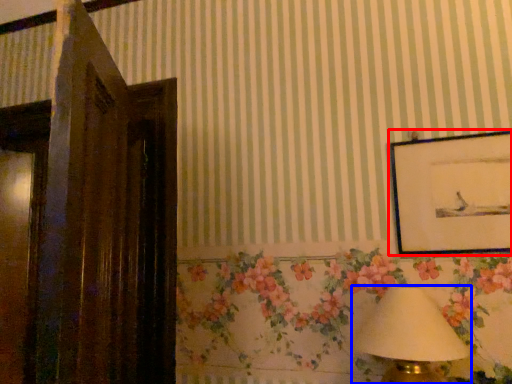
Question: Which of the following is the closest to the observer, picture frame (highlighted by a red box) or table lamp (highlighted by a blue box)?

Choices:
 (A) picture frame
 (B) table lamp

Answer: (B)